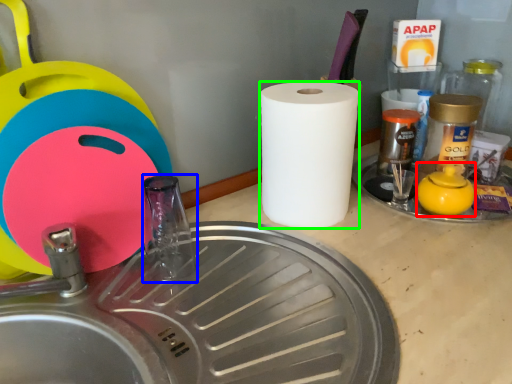
Question: Which object is the closest to the tea pot (highlighted by a red box)? Choose among these: faucet (highlighted by a blue box) or paper towel (highlighted by a green box).

Choices:
 (A) faucet
 (B) paper towel

Answer: (B)